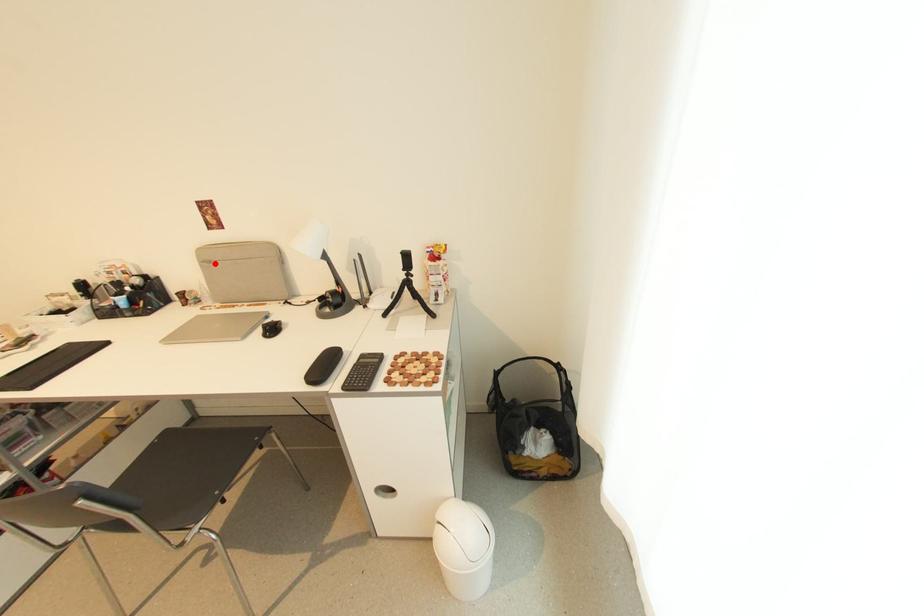
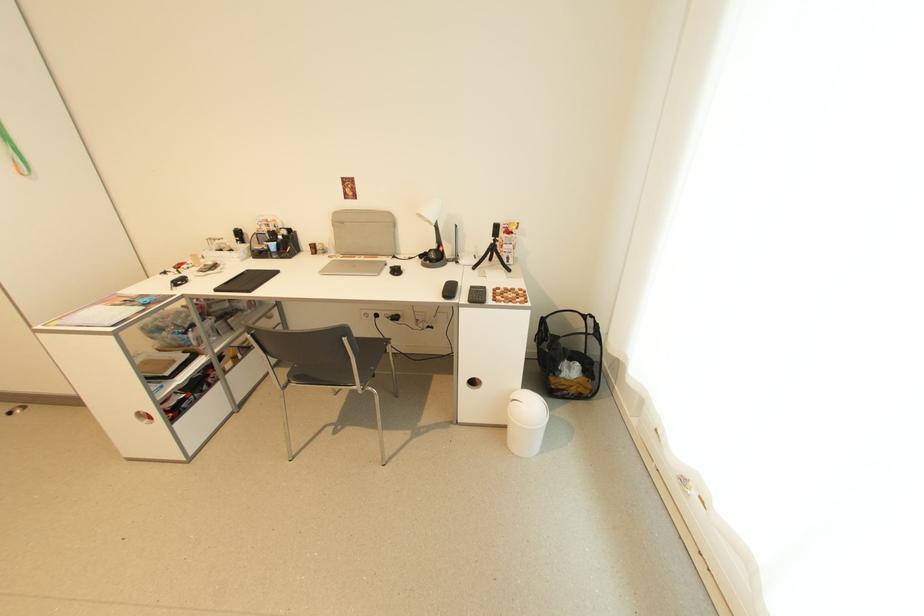
Question: I am providing you with two images of the same scene from different viewpoints. A red point is shown in image1. For the corresponding object point in image2, is it positioned nearer or farther from the camera?

Choices:
 (A) Nearer
 (B) Farther

Answer: (A)